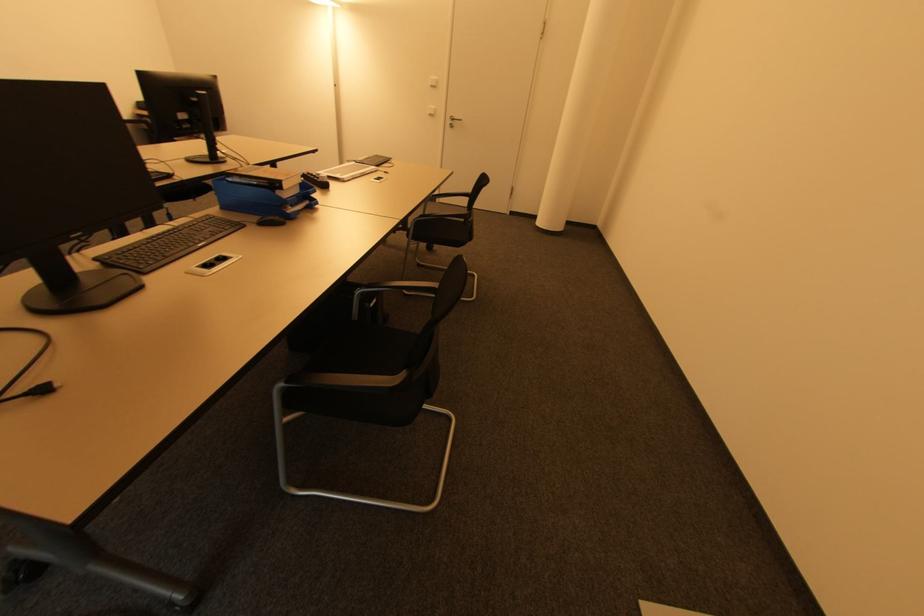
Describe the element at coordinates (271, 221) in the screenshot. I see `a black computer mouse` at that location.